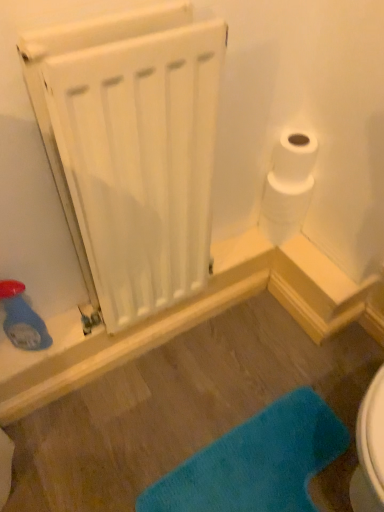
Locate an element on the screen. free point above blue fuzzy bath mat at lower center (from a real-world perspective) is located at coordinates (260, 468).